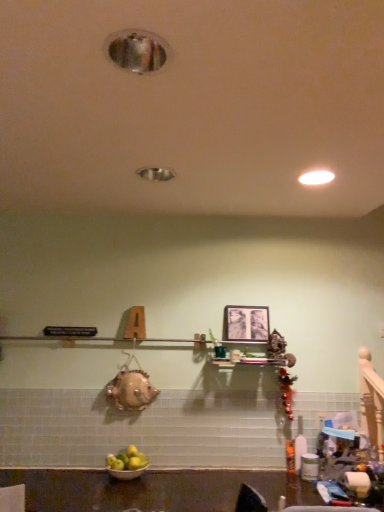
I want to click on free point above white glossy light fixture at upper right (from a real-world perspective), so click(x=315, y=180).